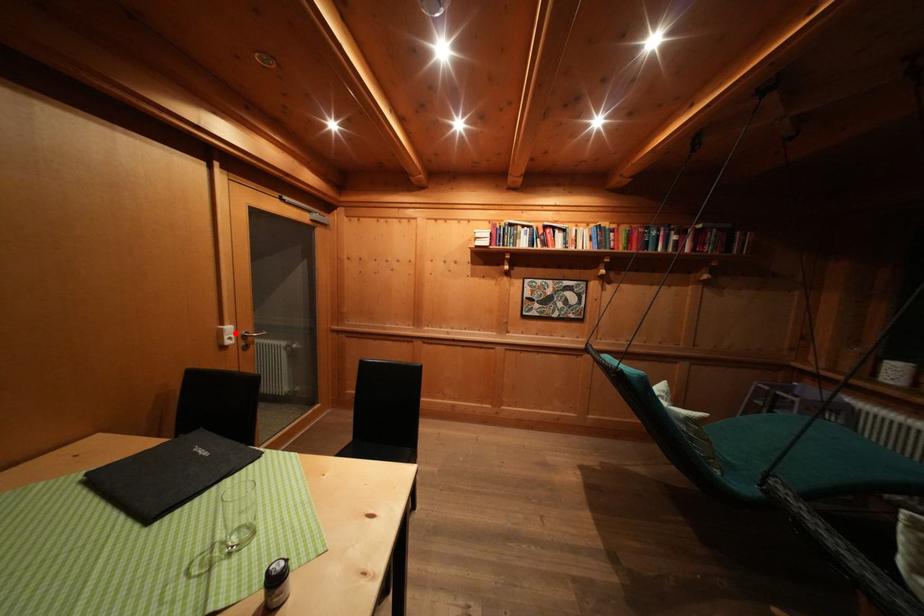
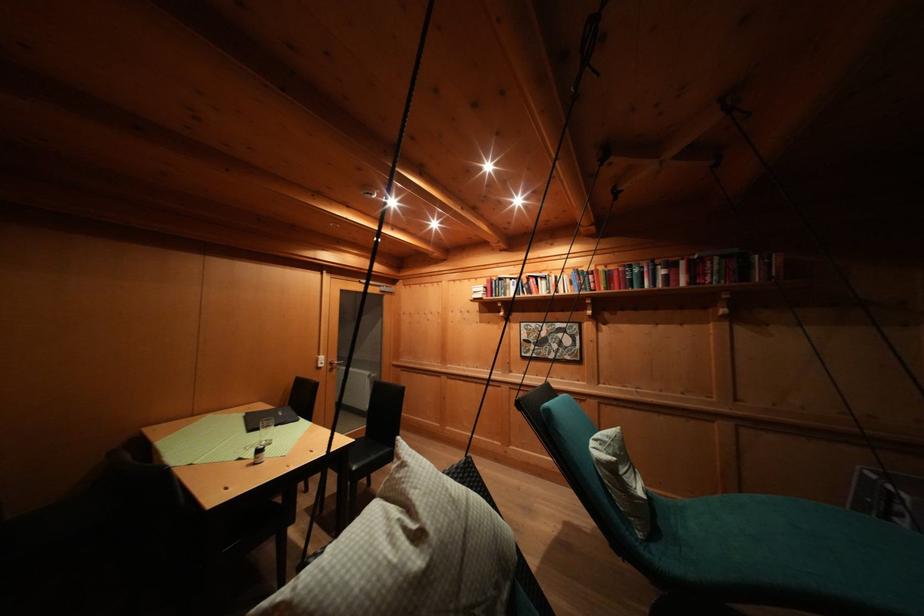
Find the pixel in the second image that matches the highlighted location in the first image.

(327, 362)